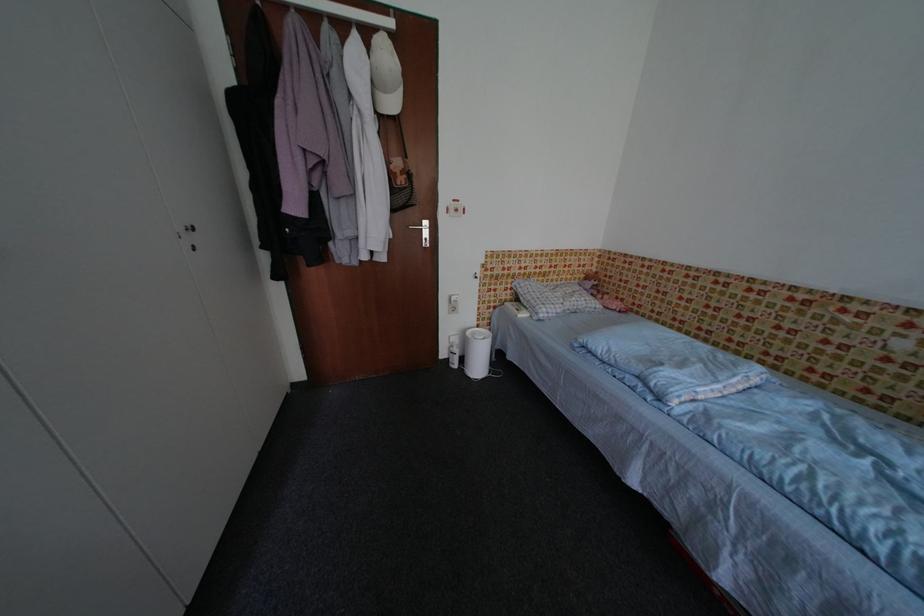
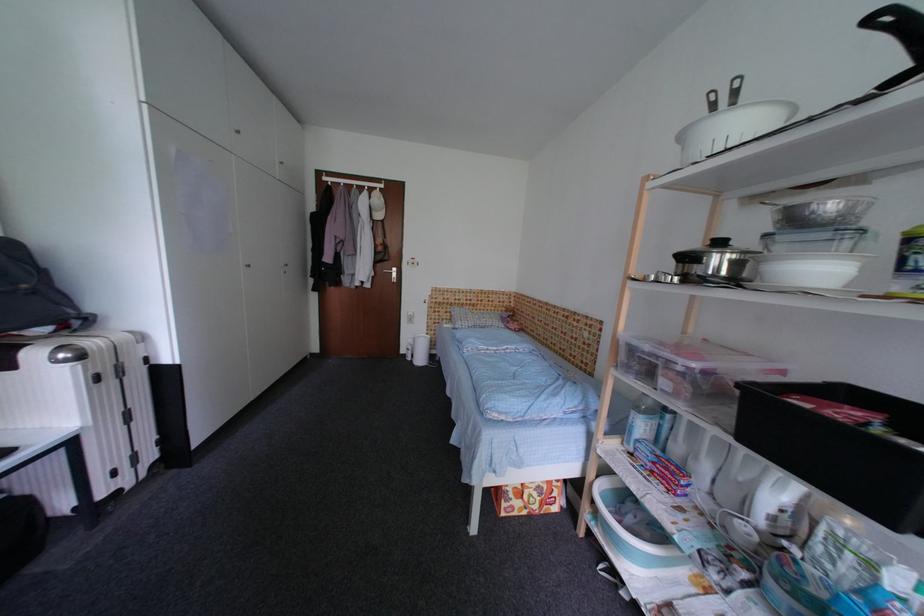
From the picture: Which direction would the cameraman need to move to produce the second image?

The cameraman moved toward right, backward.